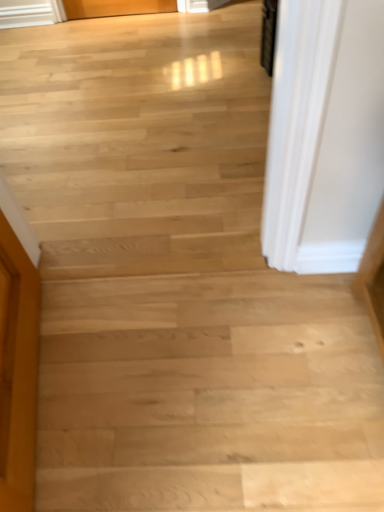
What is the approximate width of natural wood stairs at center?

natural wood stairs at center is 25.61 inches wide.

What do you see at coordinates (208, 394) in the screenshot? I see `natural wood stairs at center` at bounding box center [208, 394].

Identify the location of natural wood stairs at center. The image size is (384, 512). (208, 394).

Where is `natural wood stairs at center`? The height and width of the screenshot is (512, 384). natural wood stairs at center is located at coordinates (208, 394).